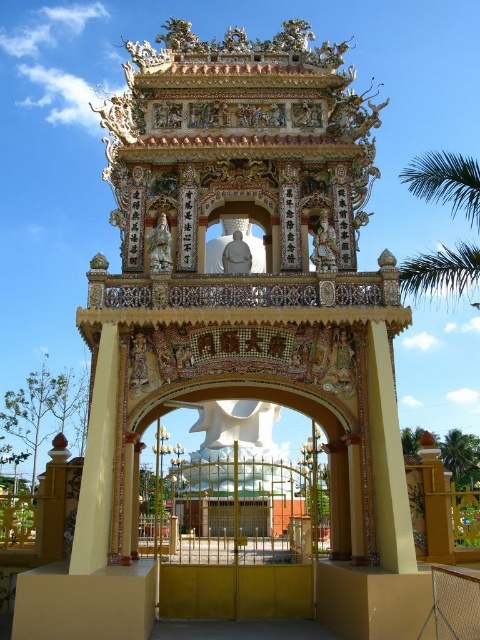
Question: Is green leafy palm tree at upper right wider than green leafy palm tree at right?

Choices:
 (A) no
 (B) yes

Answer: (B)

Question: Among these objects, which one is farthest from the camera?

Choices:
 (A) green leafy palm tree at right
 (B) green leafy palm tree at upper right

Answer: (A)

Question: Is green leafy palm tree at upper right below green leafy palm tree at right?

Choices:
 (A) yes
 (B) no

Answer: (B)

Question: Is green leafy palm tree at upper right smaller than green leafy palm tree at right?

Choices:
 (A) yes
 (B) no

Answer: (B)